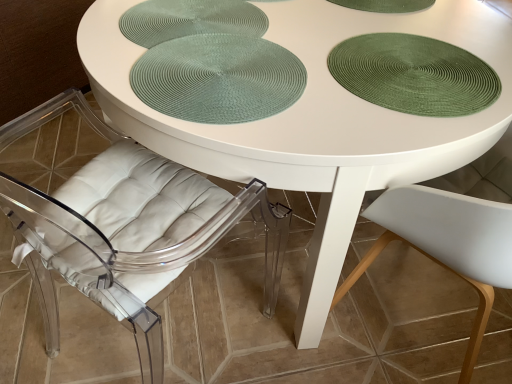
Question: Is green textured placemat at upper right, positioned as the 2th glass plate in left-to-right order, inside or outside of transparent acrylic chair at lower left?

Choices:
 (A) inside
 (B) outside

Answer: (B)

Question: Considering the positions of point (404, 94) and point (120, 206), is point (404, 94) closer or farther from the camera than point (120, 206)?

Choices:
 (A) closer
 (B) farther

Answer: (A)

Question: Based on their relative distances, which object is nearer to the green textured placemat at upper right, which is the 1th glass plate in right-to-left order?

Choices:
 (A) green woven placemat at center
 (B) green woven placemat at upper center, which ranks as the 2th glass plate in right-to-left order
 (C) transparent acrylic chair at lower left

Answer: (A)

Question: Which is farther from the green woven placemat at upper center, which ranks as the 2th glass plate in right-to-left order?

Choices:
 (A) green textured placemat at upper right, positioned as the 2th glass plate in left-to-right order
 (B) green woven placemat at center
 (C) transparent acrylic chair at lower left

Answer: (C)